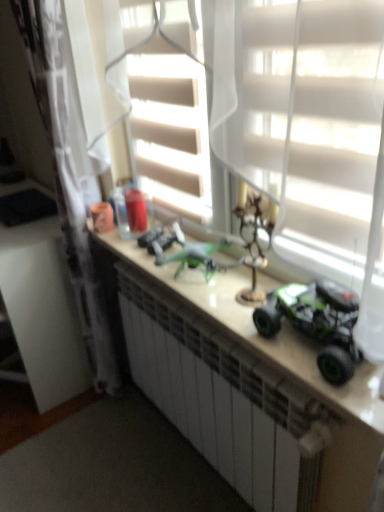
Identify the location of vacant space underneath green matte toy car at right, marked as the third toy in a left-to-right arrangement (from a real-world perspective). (297, 345).